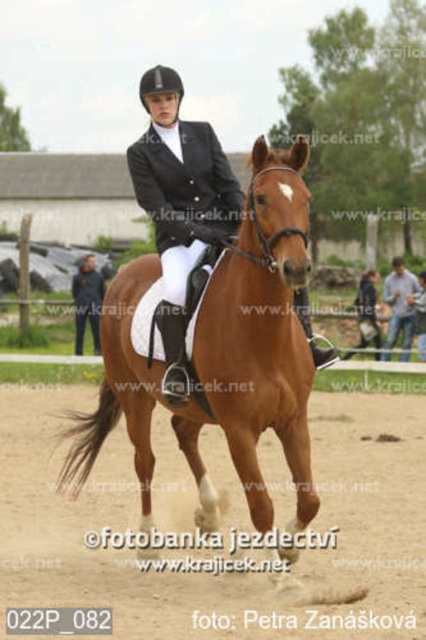
Between brown sand at center and black leather jacket at center, which one appears on the right side from the viewer's perspective?

From the viewer's perspective, black leather jacket at center appears more on the right side.

Can you confirm if brown sand at center is taller than black leather jacket at center?

No, brown sand at center is not taller than black leather jacket at center.

Identify the location of brown sand at center. This screenshot has width=426, height=640. pyautogui.click(x=227, y=572).

Where is `brown glossy horse at center`? The height and width of the screenshot is (640, 426). brown glossy horse at center is located at coordinates (221, 355).

Measure the distance between brown glossy horse at center and camera.

They are 4.72 meters apart.

I want to click on brown glossy horse at center, so click(x=221, y=355).

In the scene shown: Who is shorter, brown sand at center or brown glossy horse at center?

With less height is brown sand at center.

Is brown sand at center further to the viewer compared to brown glossy horse at center?

Yes, it is behind brown glossy horse at center.

Where is `brown sand at center`? The width and height of the screenshot is (426, 640). brown sand at center is located at coordinates (227, 572).